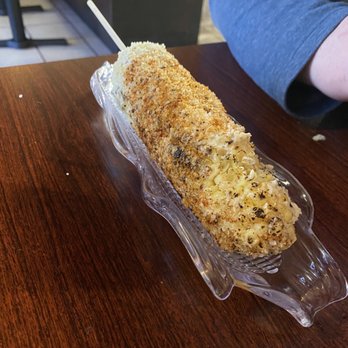
Find the location of a particular element. The height and width of the screenshot is (348, 348). black leg base of furniture, top left corner is located at coordinates (25, 39).